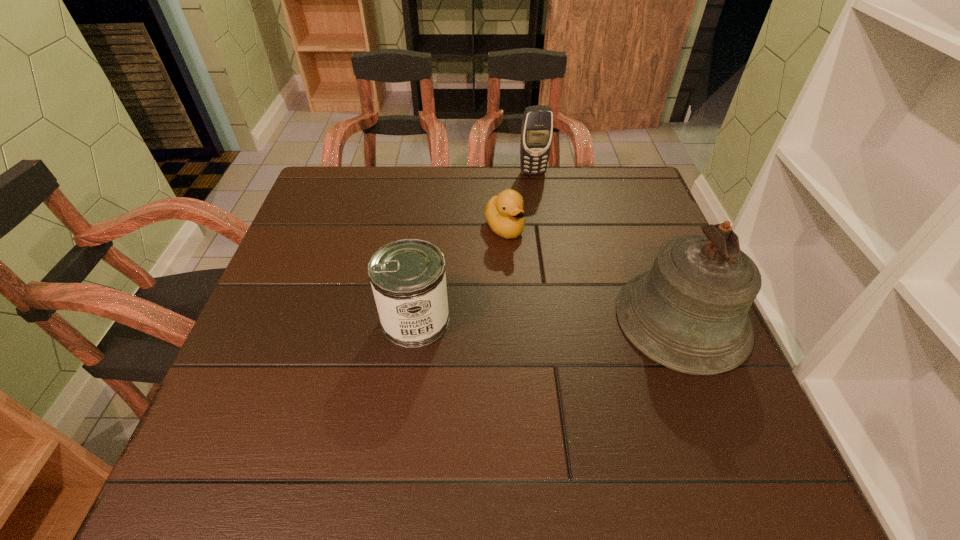
This screenshot has height=540, width=960. In order to click on free space between the cellular telephone and the leftmost object in this screenshot , I will do (x=474, y=247).

This screenshot has width=960, height=540. I want to click on free space that is in between the leftmost object and the second tallest object, so click(x=474, y=247).

Locate an element on the screen. The width and height of the screenshot is (960, 540). object that stands as the third closest to the bell is located at coordinates (537, 126).

Find the location of a particular element. The width and height of the screenshot is (960, 540). object that stands as the closest to the rightmost object is located at coordinates (504, 213).

Image resolution: width=960 pixels, height=540 pixels. Identify the location of free space that satisfies the following two spatial constraints: 1. on the back side of the bell; 2. on the right side of the can. (416, 319).